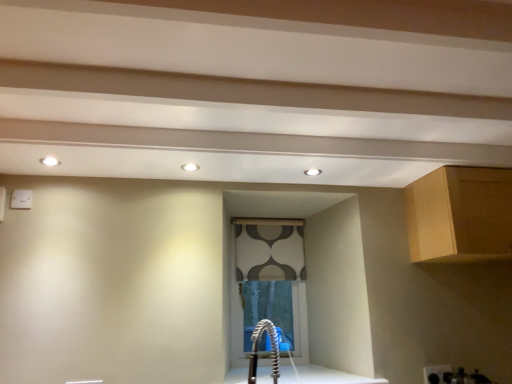
Question: From the image's perspective, is white glossy countertop at center located above or below light brown wood cabinet at upper right?

Choices:
 (A) below
 (B) above

Answer: (A)

Question: Looking at the image, does white glossy countertop at center seem bigger or smaller compared to light brown wood cabinet at upper right?

Choices:
 (A) small
 (B) big

Answer: (A)

Question: Which object is positioned closest to the light brown wood cabinet at upper right?

Choices:
 (A) white glossy countertop at center
 (B) patterned fabric window at center
 (C) satin nickel faucet at lower center

Answer: (A)

Question: Estimate the real-world distances between objects in this image. Which object is closer to the satin nickel faucet at lower center?

Choices:
 (A) white glossy countertop at center
 (B) patterned fabric window at center
 (C) light brown wood cabinet at upper right

Answer: (A)